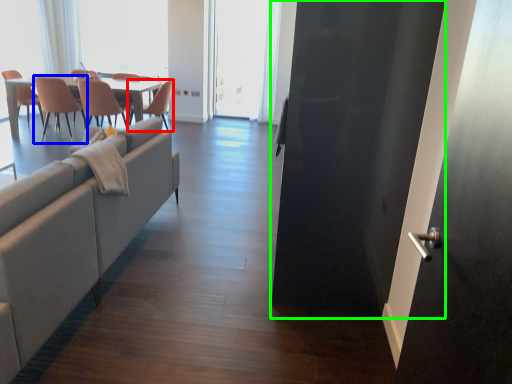
Question: Which object is positioned closest to chair (highlighted by a red box)? Select from chair (highlighted by a blue box) and screen door (highlighted by a green box).

Choices:
 (A) chair
 (B) screen door

Answer: (A)